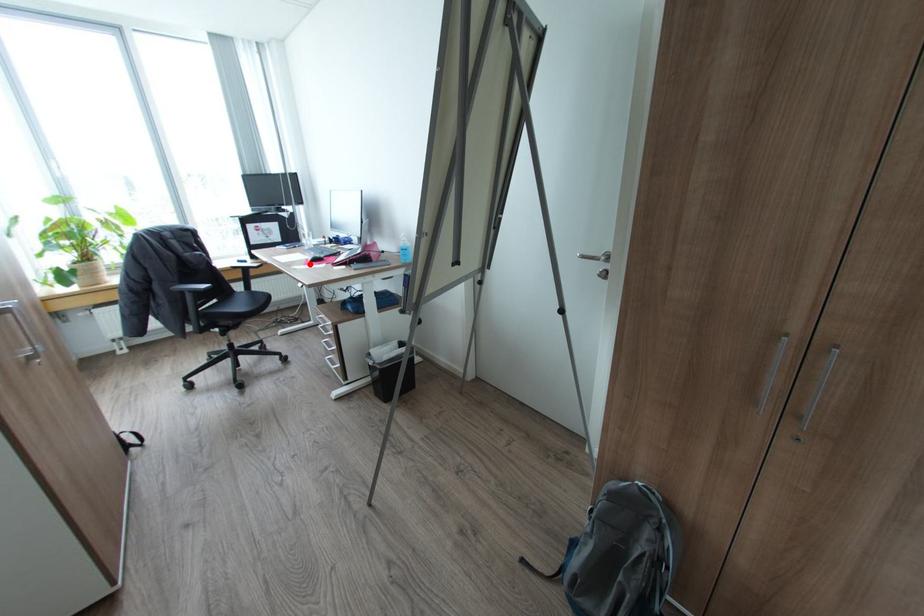
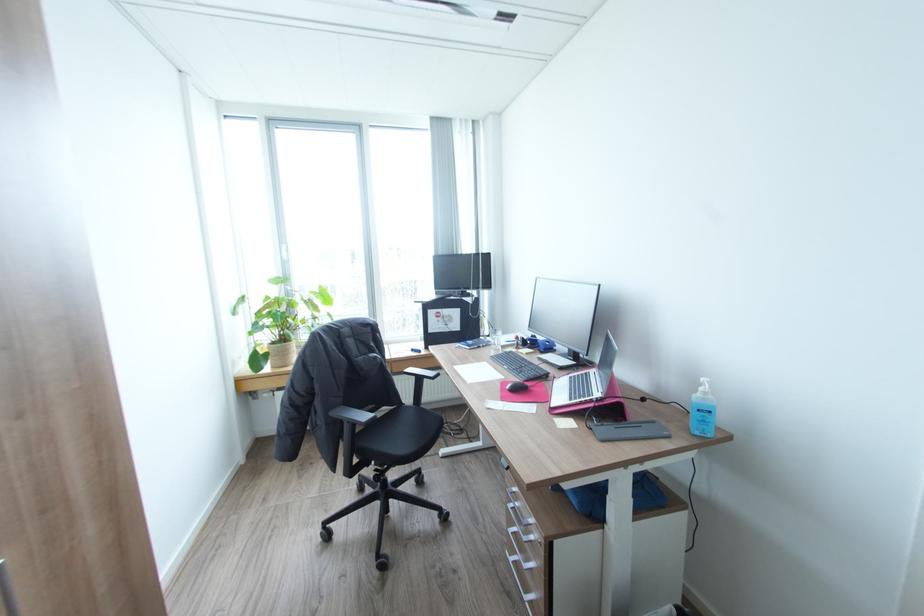
Find the pixel in the second image that matches the highlighted location in the first image.

(507, 399)